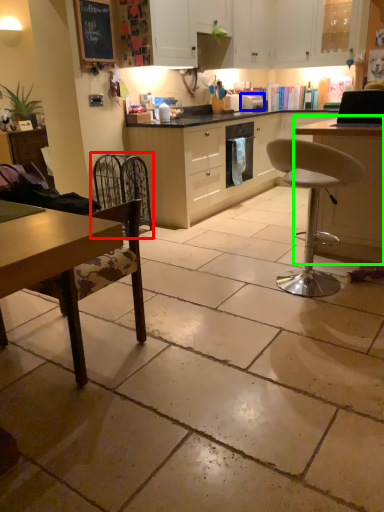
Question: Based on their relative distances, which object is nearer to swivel chair (highlighted by a red box)? Choose from appliance (highlighted by a blue box) and table (highlighted by a green box).

Choices:
 (A) appliance
 (B) table

Answer: (A)